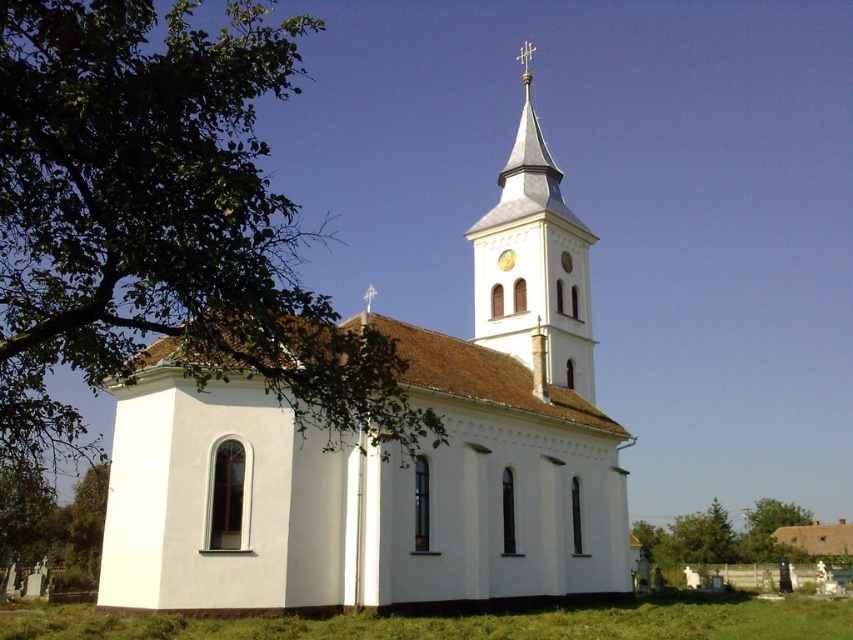
Question: Is green leafy tree at upper left to the left of white stucco tower at upper center from the viewer's perspective?

Choices:
 (A) yes
 (B) no

Answer: (A)

Question: Can you confirm if green leafy tree at upper left is thinner than white stucco tower at upper center?

Choices:
 (A) yes
 (B) no

Answer: (B)

Question: Which point appears farthest from the camera in this image?

Choices:
 (A) coord(717,618)
 (B) coord(547,301)

Answer: (B)

Question: Among these points, which one is farthest from the camera?

Choices:
 (A) (543, 410)
 (B) (756, 516)

Answer: (B)

Question: Does green leafy tree at upper left appear under white stucco tower at upper center?

Choices:
 (A) yes
 (B) no

Answer: (A)

Question: Among these points, which one is nearest to the camera?

Choices:
 (A) (527, 577)
 (B) (236, 634)

Answer: (B)